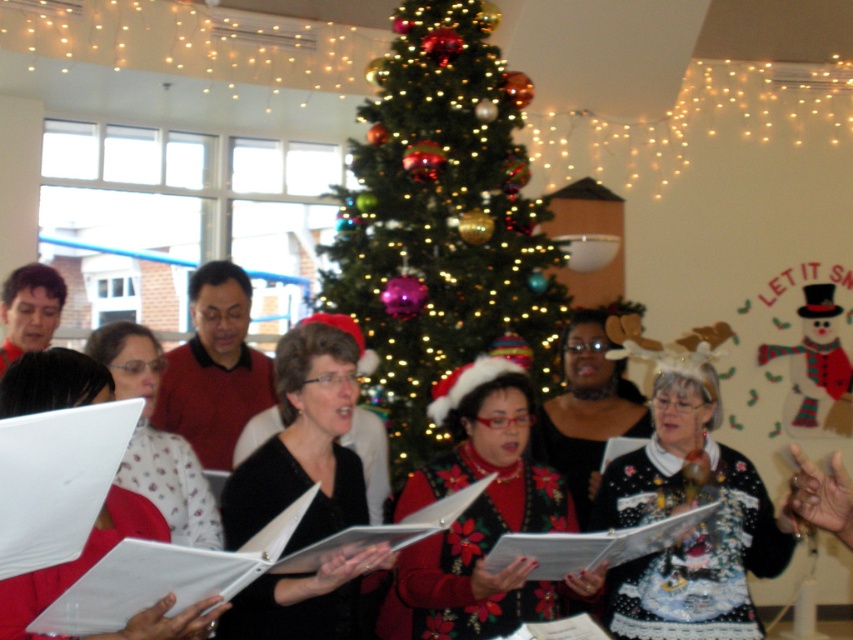
In the festive indoor scene, you see a shiny green Christmas tree at center and a group of people holding open sheet music books in front of it. If you were standing at the point with coordinates point (440, 221), where would you be located?

You would be standing on the shiny green Christmas tree at center, as point (440, 221) is located on it.